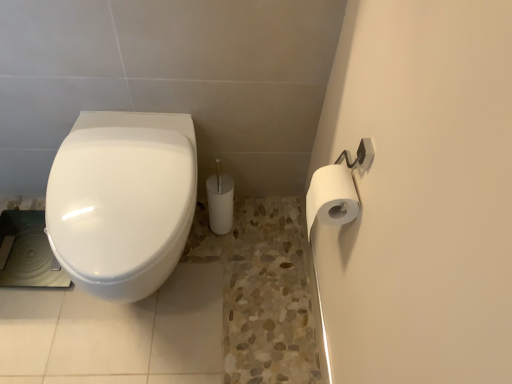
Question: Is the surface of white matte toilet paper at upper right in direct contact with white glossy toilet at left?

Choices:
 (A) yes
 (B) no

Answer: (B)

Question: From a real-world perspective, is white matte toilet paper at upper right beneath white glossy toilet at left?

Choices:
 (A) yes
 (B) no

Answer: (B)

Question: Can you confirm if white matte toilet paper at upper right is positioned to the left of white glossy toilet at left?

Choices:
 (A) yes
 (B) no

Answer: (B)

Question: Can you confirm if white matte toilet paper at upper right is bigger than white glossy toilet at left?

Choices:
 (A) no
 (B) yes

Answer: (A)

Question: Is white matte toilet paper at upper right facing away from white glossy toilet at left?

Choices:
 (A) yes
 (B) no

Answer: (B)

Question: Is the position of white matte toilet paper at upper right more distant than that of white glossy toilet at left?

Choices:
 (A) yes
 (B) no

Answer: (B)

Question: Is white glossy toilet at left closer to camera compared to white matte toilet paper at upper right?

Choices:
 (A) no
 (B) yes

Answer: (A)

Question: From a real-world perspective, is white glossy toilet at left beneath white matte toilet paper at upper right?

Choices:
 (A) no
 (B) yes

Answer: (B)

Question: From the image's perspective, is white glossy toilet at left below white matte toilet paper at upper right?

Choices:
 (A) yes
 (B) no

Answer: (A)

Question: Can you confirm if white glossy toilet at left is positioned to the left of white matte toilet paper at upper right?

Choices:
 (A) yes
 (B) no

Answer: (A)

Question: Is white glossy toilet at left not close to white matte toilet paper at upper right?

Choices:
 (A) yes
 (B) no

Answer: (B)

Question: Considering the relative sizes of white glossy toilet at left and white matte toilet paper at upper right in the image provided, is white glossy toilet at left thinner than white matte toilet paper at upper right?

Choices:
 (A) yes
 (B) no

Answer: (B)

Question: Would you say white matte toilet paper at upper right is inside or outside white glossy toilet at left?

Choices:
 (A) inside
 (B) outside

Answer: (B)